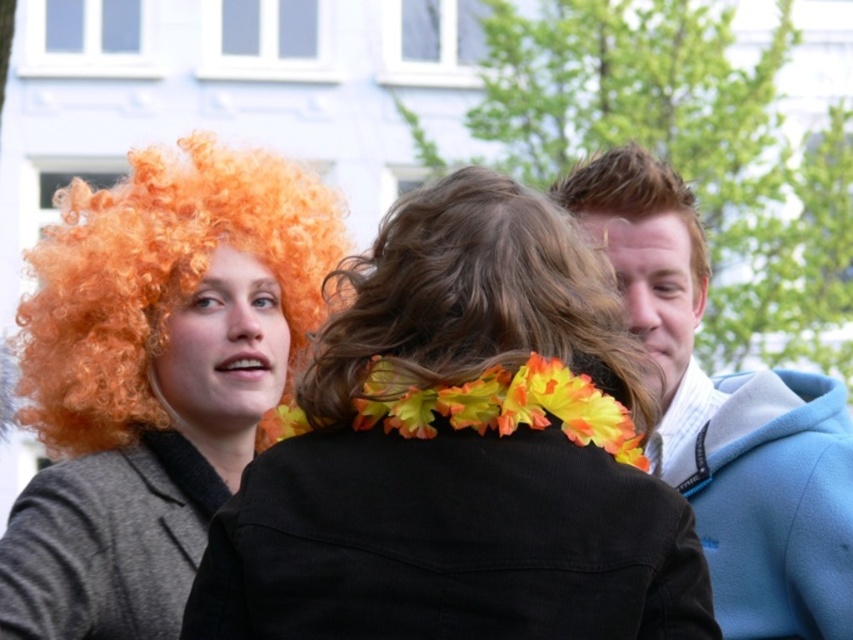
You are organizing a photo shoot and need to ensure that the light blue fleece jacket at right and the slick brown hair at upper right are visible in the frame. Based on their widths, which object might require more space horizontally to fit properly?

The light blue fleece jacket at right requires more horizontal space because its width surpasses that of the slick brown hair at upper right.

You are a photographer at the event and want to capture a photo where the curly orange wig at left is visible above the light blue fleece jacket at right. Is this possible based on their current positions?

The curly orange wig at left is below the light blue fleece jacket at right, so it would not be possible to have the curly orange wig at left visible above the light blue fleece jacket at right in their current positions.

You are standing in the festive outdoor scene and want to locate the light blue fleece jacket at right. According to the coordinates provided, where would you find it?

The light blue fleece jacket at right is located at the 2D coordinates point (728, 417).